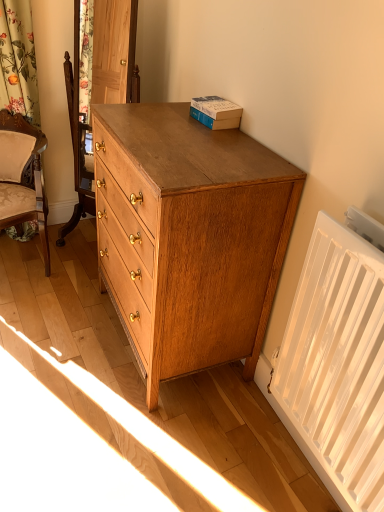
Question: Is hardcover book at upper right turned away from matte oak chest of drawers at right?

Choices:
 (A) yes
 (B) no

Answer: (B)

Question: From a real-world perspective, does hardcover book at upper right stand above matte oak chest of drawers at right?

Choices:
 (A) yes
 (B) no

Answer: (A)

Question: Is hardcover book at upper right shorter than matte oak chest of drawers at right?

Choices:
 (A) yes
 (B) no

Answer: (A)

Question: Considering the relative sizes of hardcover book at upper right and matte oak chest of drawers at right in the image provided, is hardcover book at upper right wider than matte oak chest of drawers at right?

Choices:
 (A) no
 (B) yes

Answer: (A)

Question: From a real-world perspective, is hardcover book at upper right under matte oak chest of drawers at right?

Choices:
 (A) no
 (B) yes

Answer: (A)

Question: From the image's perspective, relative to beige upholstered chair at left, is matte oak chest of drawers at right above or below?

Choices:
 (A) above
 (B) below

Answer: (B)

Question: Considering the positions of point (117, 269) and point (31, 201), is point (117, 269) closer or farther from the camera than point (31, 201)?

Choices:
 (A) farther
 (B) closer

Answer: (B)

Question: Is matte oak chest of drawers at right wider or thinner than beige upholstered chair at left?

Choices:
 (A) thin
 (B) wide

Answer: (A)

Question: Considering the relative positions of matte oak chest of drawers at right and beige upholstered chair at left in the image provided, is matte oak chest of drawers at right to the left or to the right of beige upholstered chair at left?

Choices:
 (A) left
 (B) right

Answer: (B)

Question: Considering the positions of point (36, 166) and point (256, 276), is point (36, 166) closer or farther from the camera than point (256, 276)?

Choices:
 (A) closer
 (B) farther

Answer: (B)

Question: From a real-world perspective, is beige upholstered chair at left physically located above or below matte oak chest of drawers at right?

Choices:
 (A) below
 (B) above

Answer: (A)

Question: In terms of width, does beige upholstered chair at left look wider or thinner when compared to matte oak chest of drawers at right?

Choices:
 (A) thin
 (B) wide

Answer: (B)

Question: Considering the positions of beige upholstered chair at left and matte oak chest of drawers at right in the image, is beige upholstered chair at left taller or shorter than matte oak chest of drawers at right?

Choices:
 (A) short
 (B) tall

Answer: (A)

Question: Based on their positions, is white plastic radiator at lower right located to the left or right of matte oak chest of drawers at right?

Choices:
 (A) right
 (B) left

Answer: (A)

Question: Considering the positions of white plastic radiator at lower right and matte oak chest of drawers at right in the image, is white plastic radiator at lower right bigger or smaller than matte oak chest of drawers at right?

Choices:
 (A) big
 (B) small

Answer: (B)